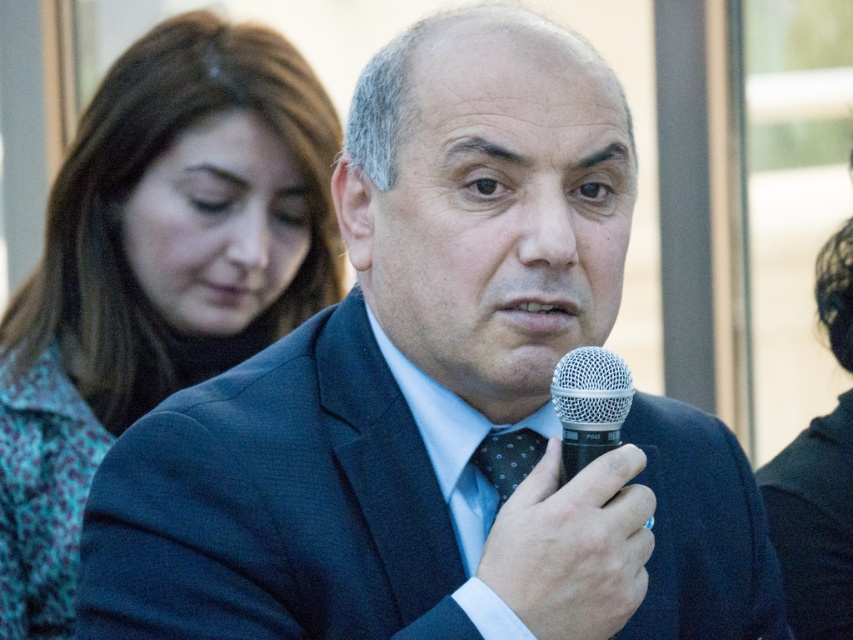
Is point (131, 330) more distant than point (496, 461)?

Yes, it is.

Does matte floral shirt at left have a lesser width compared to dark blue dotted tie at center?

Incorrect, matte floral shirt at left's width is not less than dark blue dotted tie at center's.

Is point (155, 289) in front of point (498, 500)?

No, (155, 289) is behind (498, 500).

The width and height of the screenshot is (853, 640). Find the location of `matte floral shirt at left`. matte floral shirt at left is located at coordinates (155, 273).

Is matte floral shirt at left shorter than silver metallic microphone at center?

Incorrect, matte floral shirt at left's height does not fall short of silver metallic microphone at center's.

The height and width of the screenshot is (640, 853). I want to click on matte floral shirt at left, so click(155, 273).

This screenshot has height=640, width=853. In order to click on matte floral shirt at left in this screenshot , I will do `click(155, 273)`.

Between silver metallic microphone at center and dark blue dotted tie at center, which one appears on the right side from the viewer's perspective?

Positioned to the right is silver metallic microphone at center.

Where is `silver metallic microphone at center`? This screenshot has width=853, height=640. silver metallic microphone at center is located at coordinates tap(589, 404).